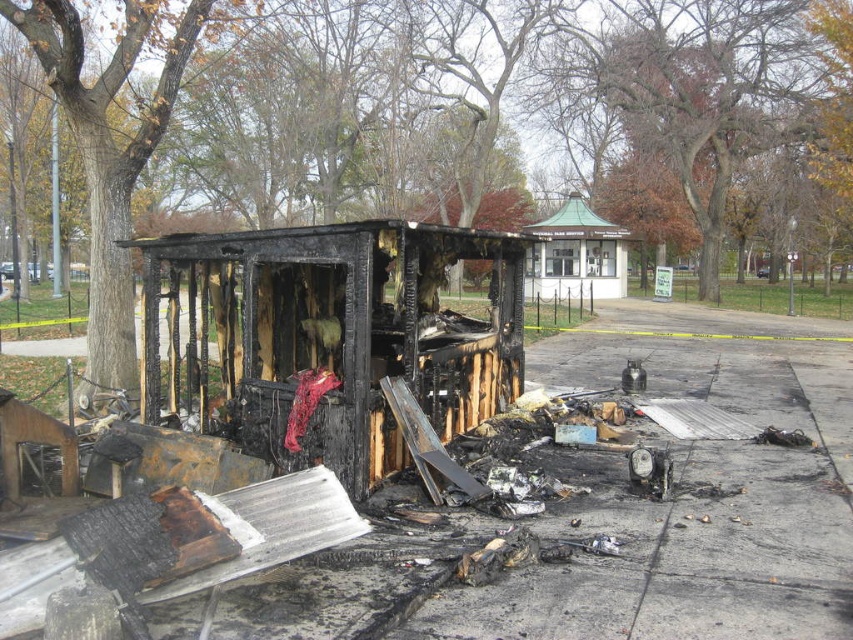
Consider the image. Who is more distant from viewer, [194,308] or [538,289]?

The point [538,289] is more distant.

Is charcoal wood gazebo at center to the right of green metal gazebo at upper center from the viewer's perspective?

No, charcoal wood gazebo at center is not to the right of green metal gazebo at upper center.

The image size is (853, 640). I want to click on charcoal wood gazebo at center, so [335, 337].